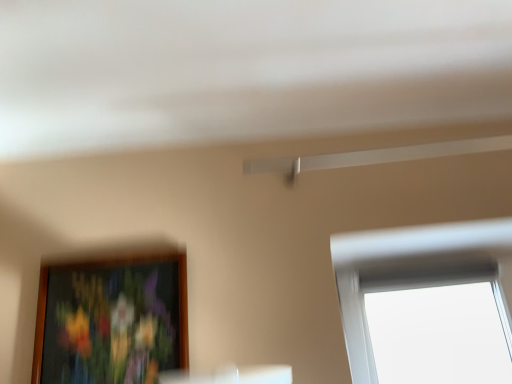
Locate an element on the screen. Image resolution: width=512 pixels, height=384 pixels. wooden picture frame at lower left is located at coordinates (111, 319).

Describe the element at coordinates (111, 319) in the screenshot. This screenshot has width=512, height=384. I see `wooden picture frame at lower left` at that location.

Image resolution: width=512 pixels, height=384 pixels. What are the coordinates of `wooden picture frame at lower left` in the screenshot? It's located at [x=111, y=319].